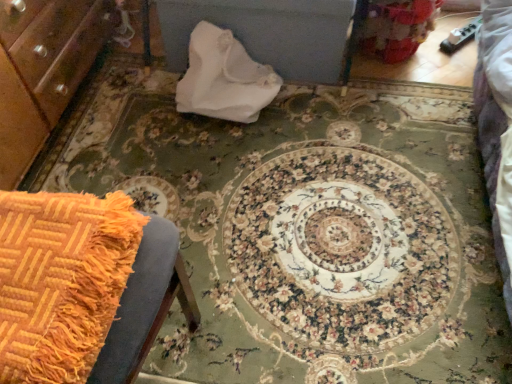
Image resolution: width=512 pixels, height=384 pixels. I want to click on vacant space to the right of white paper bag at center, so click(x=319, y=115).